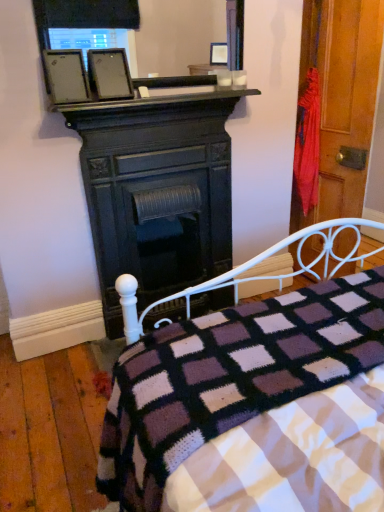
Question: Considering the relative sizes of knitted woolen blanket at lower center and black matte fireplace at upper center in the image provided, is knitted woolen blanket at lower center thinner than black matte fireplace at upper center?

Choices:
 (A) yes
 (B) no

Answer: (B)

Question: Is knitted woolen blanket at lower center not close to black matte fireplace at upper center?

Choices:
 (A) no
 (B) yes

Answer: (B)

Question: Is knitted woolen blanket at lower center positioned with its back to black matte fireplace at upper center?

Choices:
 (A) yes
 (B) no

Answer: (B)

Question: Can you confirm if knitted woolen blanket at lower center is positioned to the left of black matte fireplace at upper center?

Choices:
 (A) no
 (B) yes

Answer: (A)

Question: Can you confirm if knitted woolen blanket at lower center is taller than black matte fireplace at upper center?

Choices:
 (A) yes
 (B) no

Answer: (A)

Question: Visually, is black matte fireplace at upper center positioned to the left or to the right of wooden door at right?

Choices:
 (A) right
 (B) left

Answer: (B)

Question: Looking at their shapes, would you say black matte fireplace at upper center is wider or thinner than wooden door at right?

Choices:
 (A) wide
 (B) thin

Answer: (A)

Question: Is black matte fireplace at upper center situated inside wooden door at right or outside?

Choices:
 (A) outside
 (B) inside

Answer: (A)

Question: Is point (105, 104) positioned closer to the camera than point (349, 118)?

Choices:
 (A) farther
 (B) closer

Answer: (B)

Question: From a real-world perspective, is matte black picture frame at upper center above or below knitted woolen blanket at lower center?

Choices:
 (A) below
 (B) above

Answer: (B)

Question: In terms of size, does matte black picture frame at upper center appear bigger or smaller than knitted woolen blanket at lower center?

Choices:
 (A) small
 (B) big

Answer: (A)

Question: Based on their positions, is matte black picture frame at upper center located to the left or right of knitted woolen blanket at lower center?

Choices:
 (A) left
 (B) right

Answer: (A)

Question: Is matte black picture frame at upper center inside or outside of knitted woolen blanket at lower center?

Choices:
 (A) inside
 (B) outside

Answer: (B)

Question: Relative to wooden door at right, is matte black picture frame at upper center in front or behind?

Choices:
 (A) front
 (B) behind

Answer: (A)

Question: Based on their sizes in the image, would you say matte black picture frame at upper center is bigger or smaller than wooden door at right?

Choices:
 (A) big
 (B) small

Answer: (B)